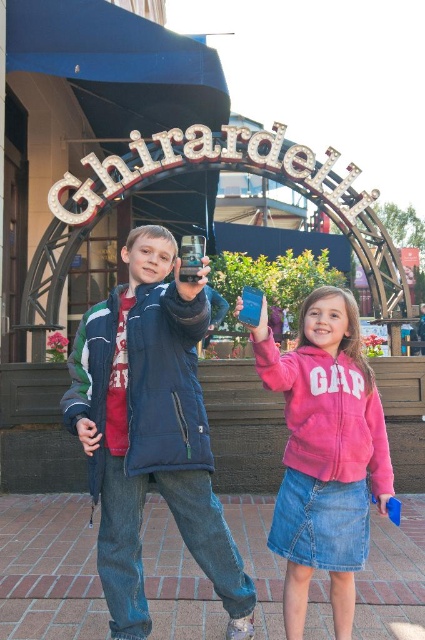
Between point (190, 298) and point (336, 529), which one is positioned behind?

The point (190, 298) is behind.

Can you confirm if matte blue jacket at center is positioned above pink fleece jacket at center?

Correct, matte blue jacket at center is located above pink fleece jacket at center.

Image resolution: width=425 pixels, height=640 pixels. I want to click on matte blue jacket at center, so click(x=150, y=429).

Identify the location of matte blue jacket at center. [x=150, y=429].